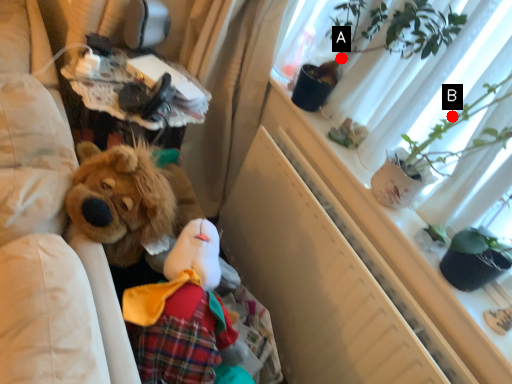
Question: Two points are circled on the image, labeled by A and B beside each circle. Which point is further to the camera?

Choices:
 (A) A is further
 (B) B is further

Answer: (A)